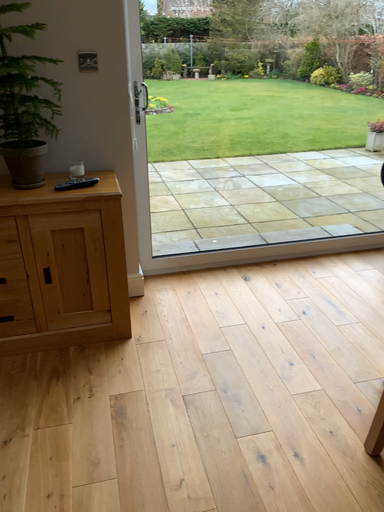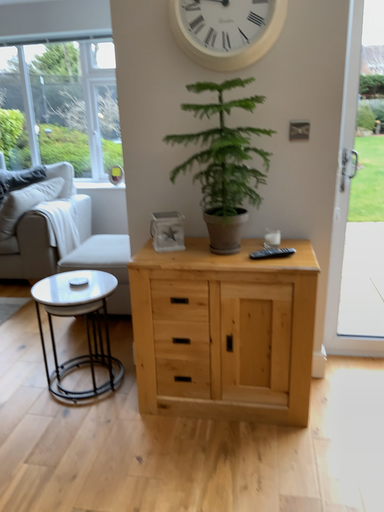
Question: Which way did the camera rotate in the video?

Choices:
 (A) rotated upward
 (B) rotated downward

Answer: (A)